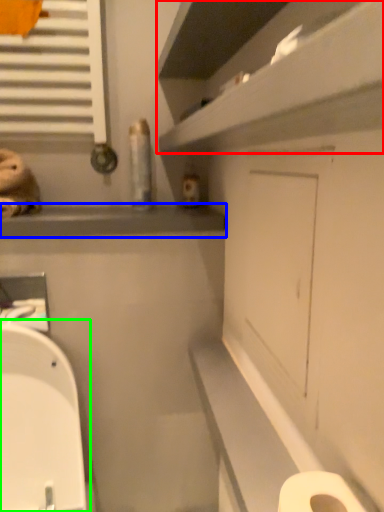
Question: Based on their relative distances, which object is nearer to shelf (highlighted by a red box)? Choose from window sill (highlighted by a blue box) and toilet (highlighted by a green box).

Choices:
 (A) window sill
 (B) toilet

Answer: (A)